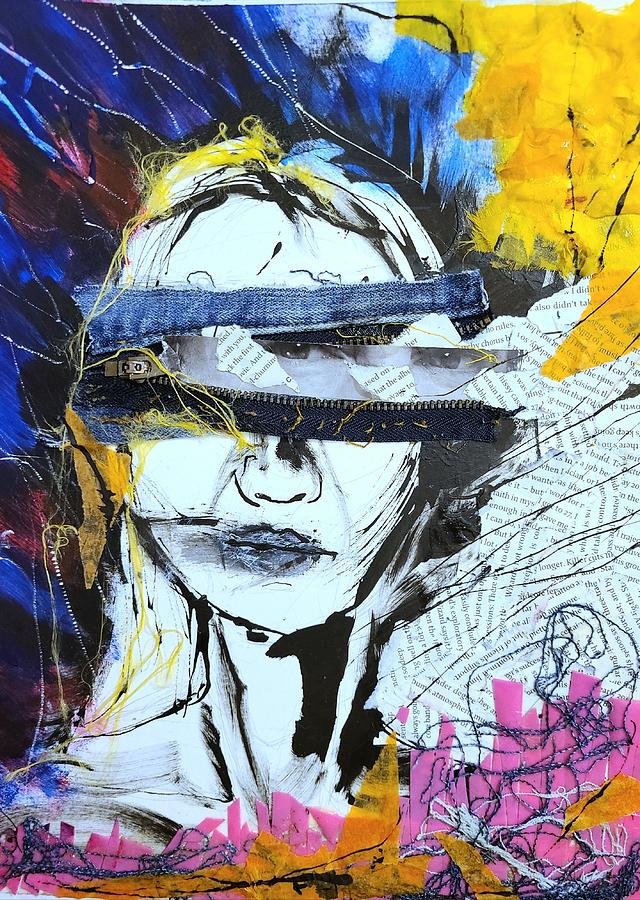
This screenshot has height=900, width=640. I want to click on fabric, so click(516, 792).